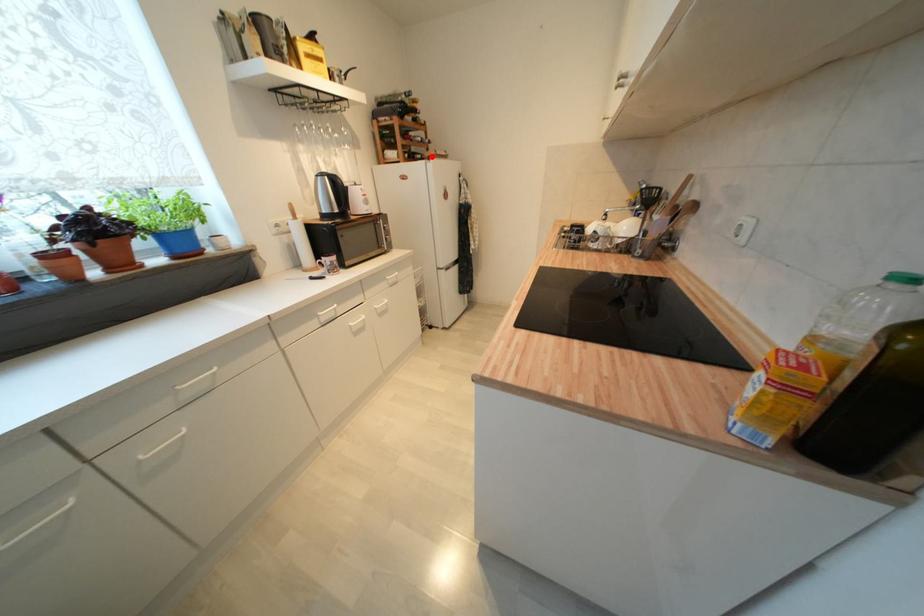
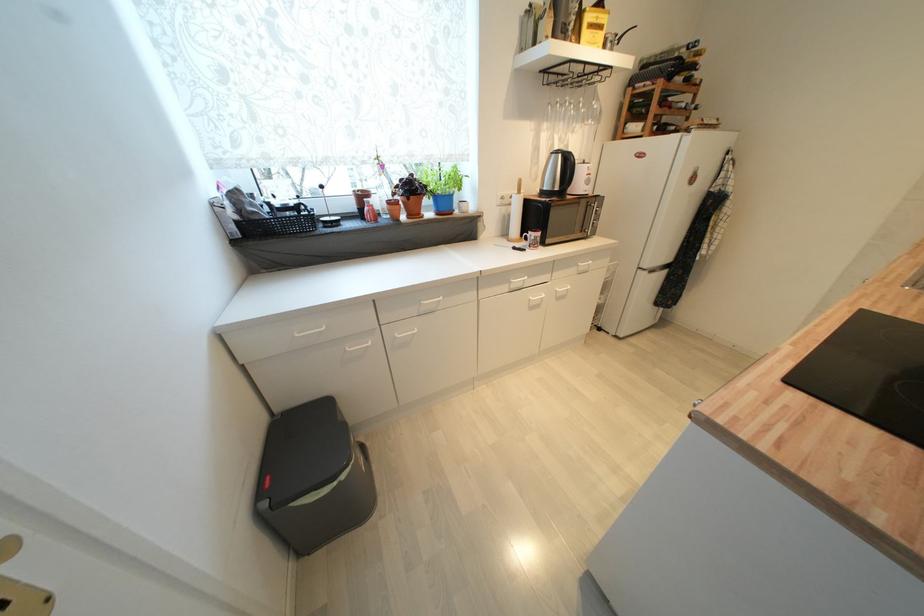
Question: I am providing you with two images of the same scene from different viewpoints. A red point is shown in image1. For the corresponding object point in image2, is it positioned nearer or farther from the camera?

Choices:
 (A) Nearer
 (B) Farther

Answer: (B)